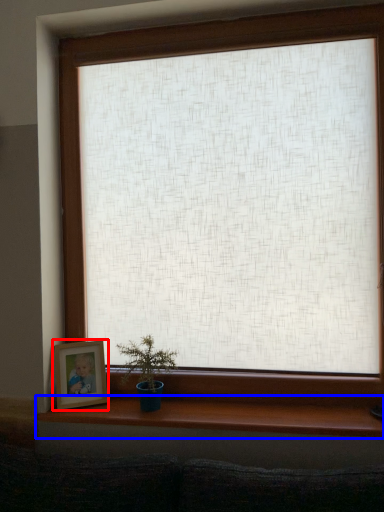
Question: Which of the following is the closest to the observer, picture frame (highlighted by a red box) or window sill (highlighted by a blue box)?

Choices:
 (A) picture frame
 (B) window sill

Answer: (B)